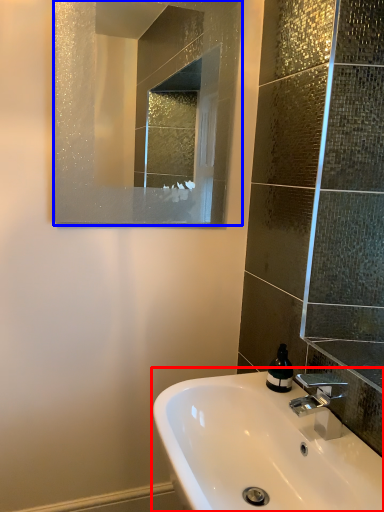
Question: Which object appears farthest to the camera in this image, sink (highlighted by a red box) or mirror (highlighted by a blue box)?

Choices:
 (A) sink
 (B) mirror

Answer: (B)